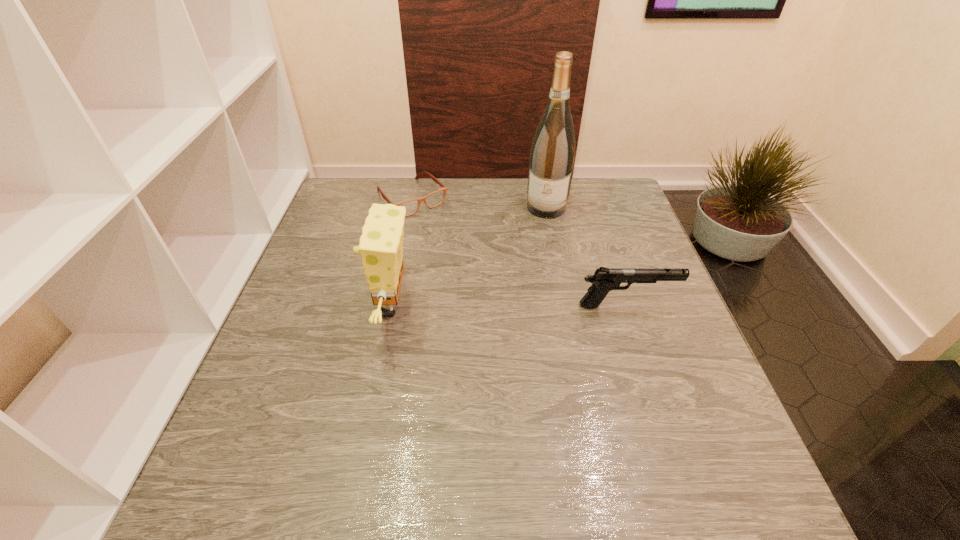
Where is `vacant spot on the desktop that is between the third shortest object and the gun and is positioned on the label of the tallest object`? The image size is (960, 540). vacant spot on the desktop that is between the third shortest object and the gun and is positioned on the label of the tallest object is located at coordinates (524, 306).

The width and height of the screenshot is (960, 540). In order to click on vacant space on the desktop that is between the second tallest object and the gun and is positioned on the front-facing side of the spectacles in this screenshot , I will do `click(516, 306)`.